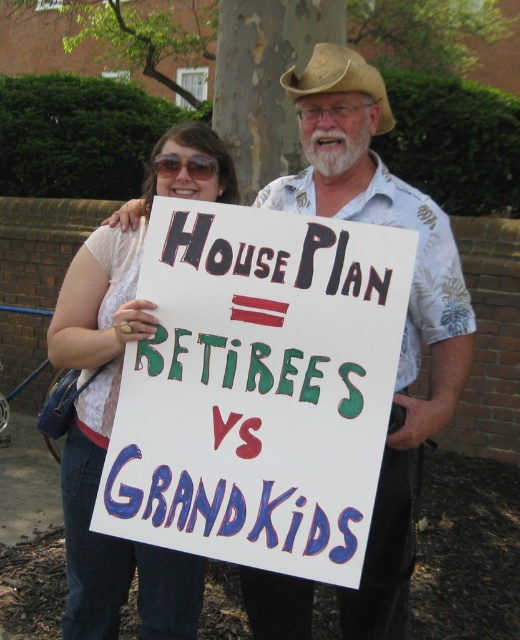
Is the position of white paper sign at center less distant than that of white floral shirt at center?

Yes, white paper sign at center is closer to the viewer.

Does white paper sign at center have a larger size compared to white floral shirt at center?

Actually, white paper sign at center might be smaller than white floral shirt at center.

Image resolution: width=520 pixels, height=640 pixels. I want to click on white paper sign at center, so click(x=257, y=388).

Who is shorter, white floral shirt at center or white lace shirt at upper left?

Standing shorter between the two is white lace shirt at upper left.

Does point (433, 428) lie behind point (105, 637)?

No, (433, 428) is in front of (105, 637).

Locate an element on the screen. The width and height of the screenshot is (520, 640). white floral shirt at center is located at coordinates (408, 307).

Locate an element on the screen. This screenshot has width=520, height=640. white floral shirt at center is located at coordinates (408, 307).

Is white paper sign at center closer to the viewer compared to tan straw cowboy hat at upper center?

Yes, it is.

Is point (279, 410) closer to camera compared to point (305, 84)?

Yes, point (279, 410) is in front of point (305, 84).

Who is more distant from viewer, (274,218) or (341,67)?

Point (341,67)

Locate an element on the screen. The width and height of the screenshot is (520, 640). white paper sign at center is located at coordinates (257, 388).